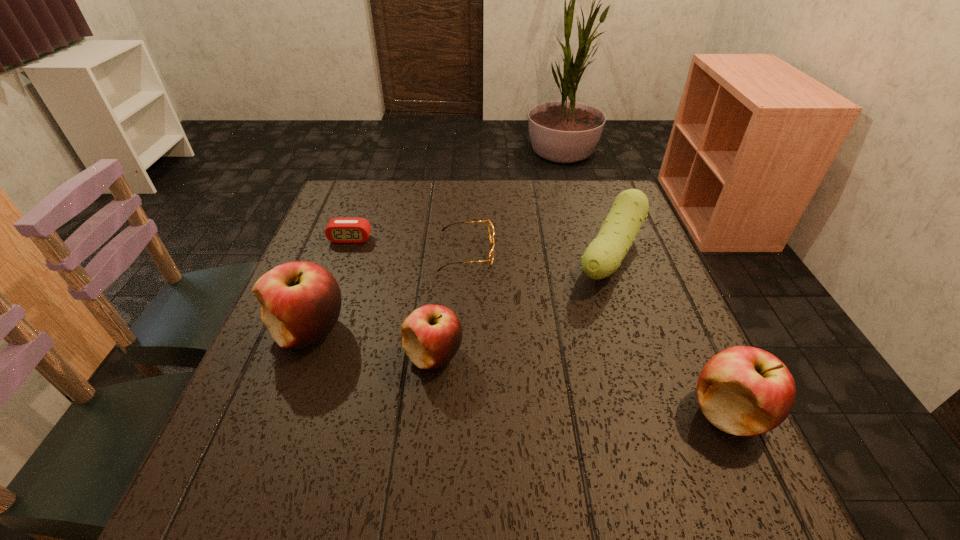
At what (x,y) coordinates should I click in order to perform the action: click on free spot that satisfies the following two spatial constraints: 1. on the front side of the leftmost apple; 2. on the right side of the shortest apple. Please return your answer as a coordinate pair (x, y). Looking at the image, I should click on (300, 355).